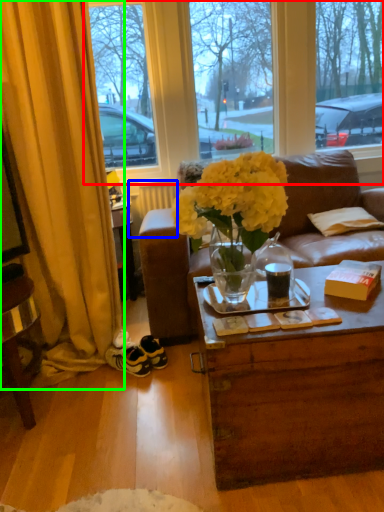
Question: Which is nearer to the window (highlighted by a red box)? radiator (highlighted by a blue box) or curtain (highlighted by a green box).

Choices:
 (A) radiator
 (B) curtain

Answer: (A)